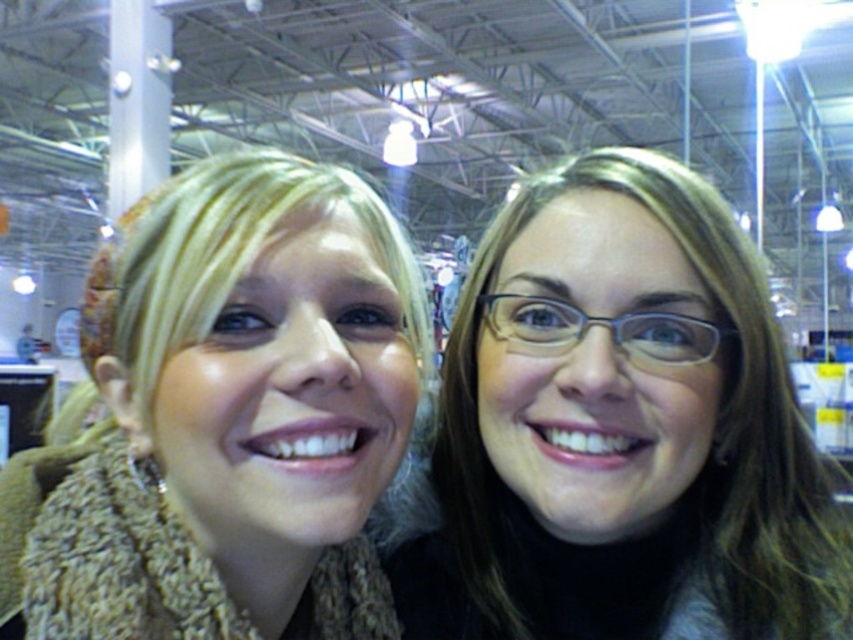
You are a photographer adjusting your camera settings to capture a closeup shot of the matte black glasses at upper right and the knitted beige scarf at left. The camera has a depth of field that can focus clearly on objects within a 6 inch range. Will both objects be in focus simultaneously?

The matte black glasses at upper right and knitted beige scarf at left are 6.67 inches apart from each other. Since the depth of field can only focus within a 6 inch range, they are slightly beyond the focus range, so both cannot be in focus at the same time.

You are a photographer trying to capture a closeup of the matte black glasses at upper right. The camera you are using has a 100mm lens. Based on the scene description, can you estimate if the glasses will be in focus if you focus on the person on the left?

The glasses are located at point (x=622, y=429), which is outside the immediate focus area of the person on the left. Therefore, focusing on the person on the left may result in the glasses being slightly out of focus. To ensure the glasses are sharp, you should adjust the focus point to their location.